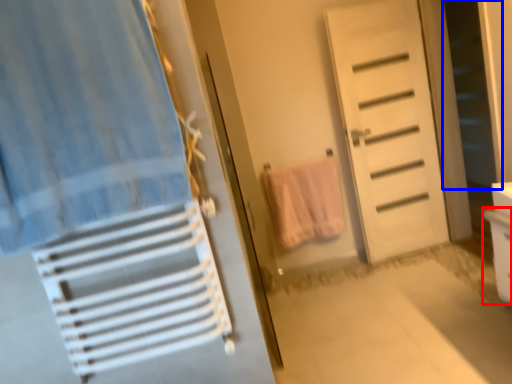
Question: Which point is closer to the camera, drawer (highlighted by a red box) or screen door (highlighted by a blue box)?

Choices:
 (A) drawer
 (B) screen door

Answer: (A)